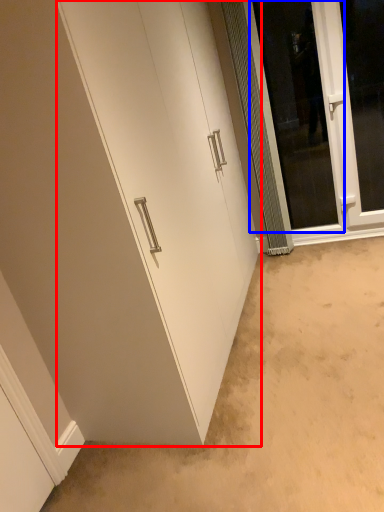
Question: Which object is closer to the camera taking this photo, door (highlighted by a red box) or screen door (highlighted by a blue box)?

Choices:
 (A) door
 (B) screen door

Answer: (A)